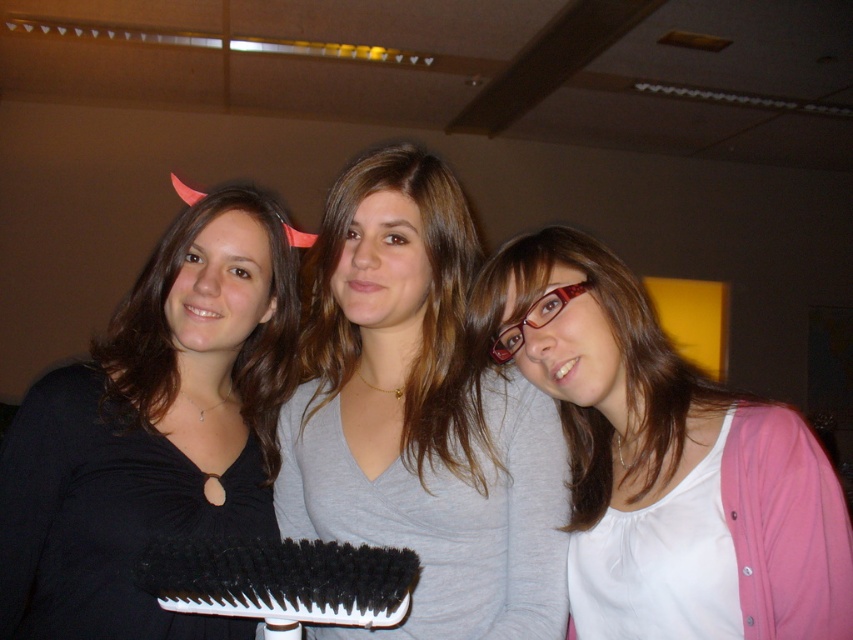
You are trying to decide which of the two people at the center of the image has a wider torso. The options are the gray matte shirt at center and the brownsmoothhair at center. Based on their positions, can you determine which one has a wider torso?

The gray matte shirt at center might be wider than brownsmoothhair at center, so it is possible that the person wearing the gray matte shirt at center has a wider torso.

You are a photographer trying to capture a clear photo of the brownsmoothhair at center and the black bristle brush at center. Since the two objects are very close to each other, you need to adjust your focus. Which object should you focus on to ensure it appears larger in the photo?

The brownsmoothhair at center is larger in size than the black bristle brush at center, so focusing on the brownsmoothhair at center will ensure it appears larger in the photo.